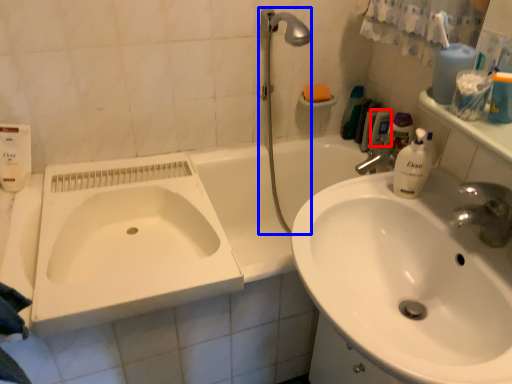
Question: Among these objects, which one is farthest to the camera, mouthwash (highlighted by a red box) or shower (highlighted by a blue box)?

Choices:
 (A) mouthwash
 (B) shower

Answer: (A)